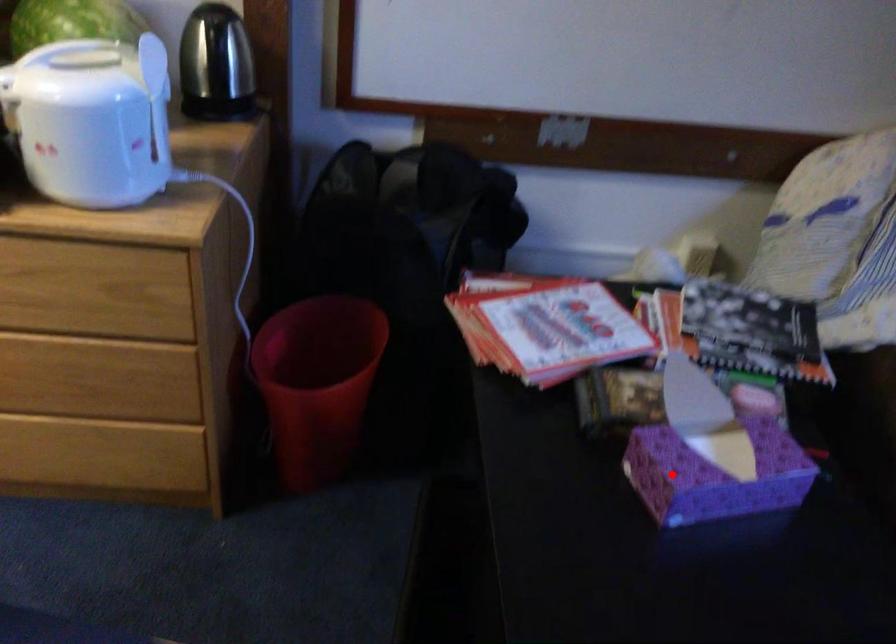
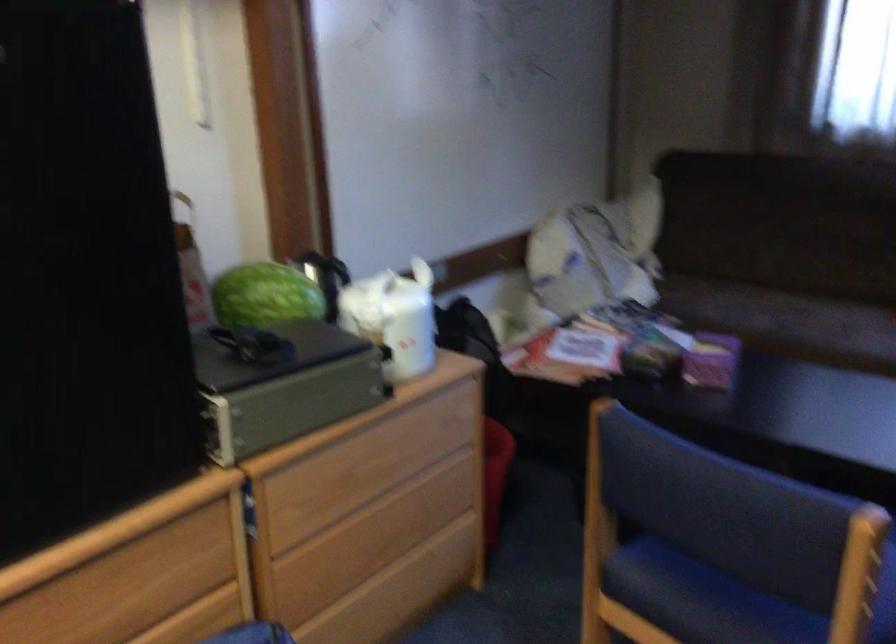
Where in the second image is the point corresponding to the highlighted location from the first image?

(711, 361)